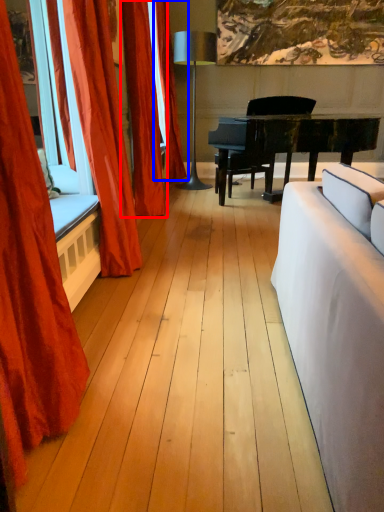
Question: Which of the following is the farthest to the observer, curtain (highlighted by a red box) or curtain (highlighted by a blue box)?

Choices:
 (A) curtain
 (B) curtain

Answer: (B)